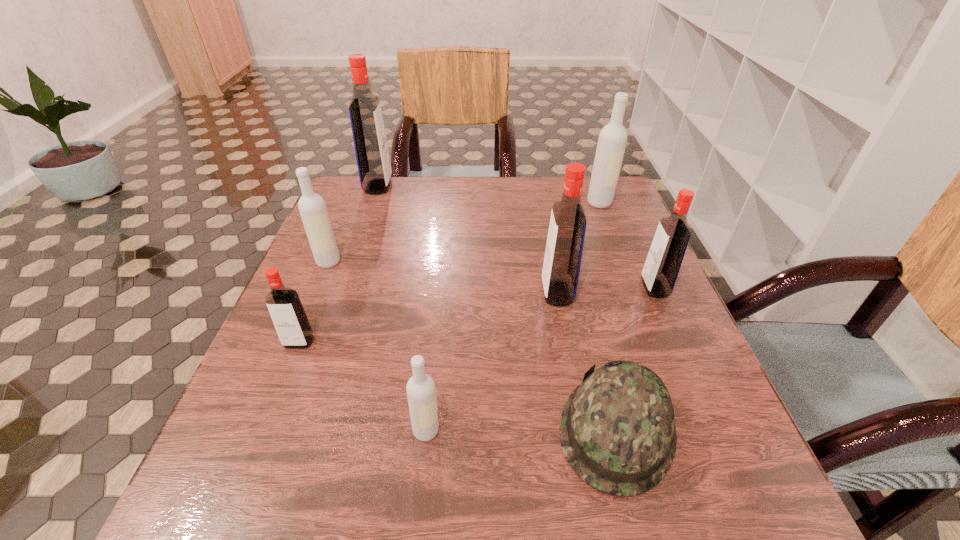
Identify the location of the farthest red vodka. The height and width of the screenshot is (540, 960). (372, 155).

Locate an element on the screen. the tallest object is located at coordinates (372, 155).

Locate an element on the screen. the farthest white vodka is located at coordinates (612, 140).

Where is `the rightmost white vodka`? The height and width of the screenshot is (540, 960). the rightmost white vodka is located at coordinates (612, 140).

Where is `the second biggest red vodka`? the second biggest red vodka is located at coordinates (564, 247).

The image size is (960, 540). In order to click on the second red vodka from right to left in this screenshot , I will do `click(564, 247)`.

The height and width of the screenshot is (540, 960). Identify the location of the second smallest white vodka. (312, 207).

At what (x,y) coordinates should I click in order to perform the action: click on the leftmost white vodka. Please return your answer as a coordinate pair (x, y). Image resolution: width=960 pixels, height=540 pixels. Looking at the image, I should click on (312, 207).

Where is `the rightmost red vodka`? The height and width of the screenshot is (540, 960). the rightmost red vodka is located at coordinates (662, 265).

Identify the location of the second nearest vodka. This screenshot has width=960, height=540. (287, 313).